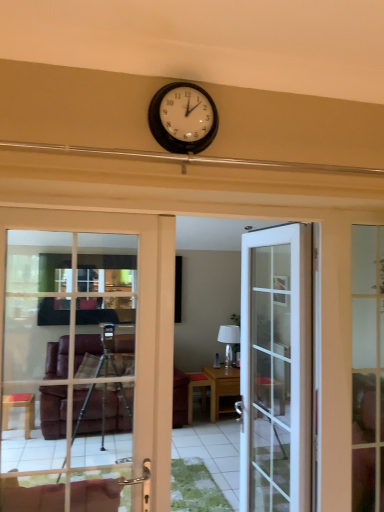
Question: Is matte black clock at upper center taller or shorter than wooden table at center, the 1th table from the right?

Choices:
 (A) tall
 (B) short

Answer: (B)

Question: Is matte black clock at upper center in front of or behind wooden table at center, the 1th table from the right, in the image?

Choices:
 (A) behind
 (B) front

Answer: (B)

Question: Estimate the real-world distances between objects in this image. Which object is closer to the wooden table at center, which appears as the first table when viewed from the left?

Choices:
 (A) matte black clock at upper center
 (B) white glass door at left, which is the first door in left-to-right order
 (C) wooden table at center, the 1th table from the right
 (D) white glass door at center, which is the 2th door from left to right
 (E) white glossy lamp at center

Answer: (C)

Question: Which is farther from the wooden table at center, placed as the second table when sorted from right to left?

Choices:
 (A) white glass door at center, which is the 1th door in back-to-front order
 (B) white glass door at left, the second door positioned from the right
 (C) wooden table at center, the 1th table from the right
 (D) matte black clock at upper center
 (E) matte glass door at right

Answer: (D)